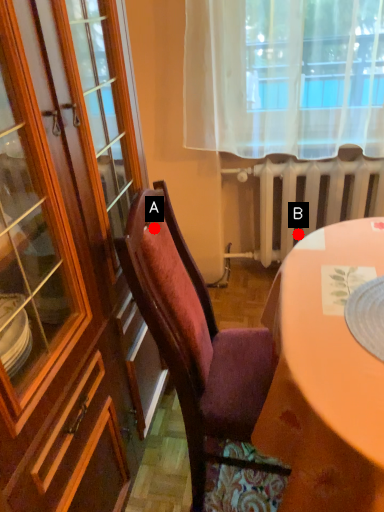
Question: Two points are circled on the image, labeled by A and B beside each circle. Which of the following is the closest to the observer?

Choices:
 (A) A is closer
 (B) B is closer

Answer: (A)